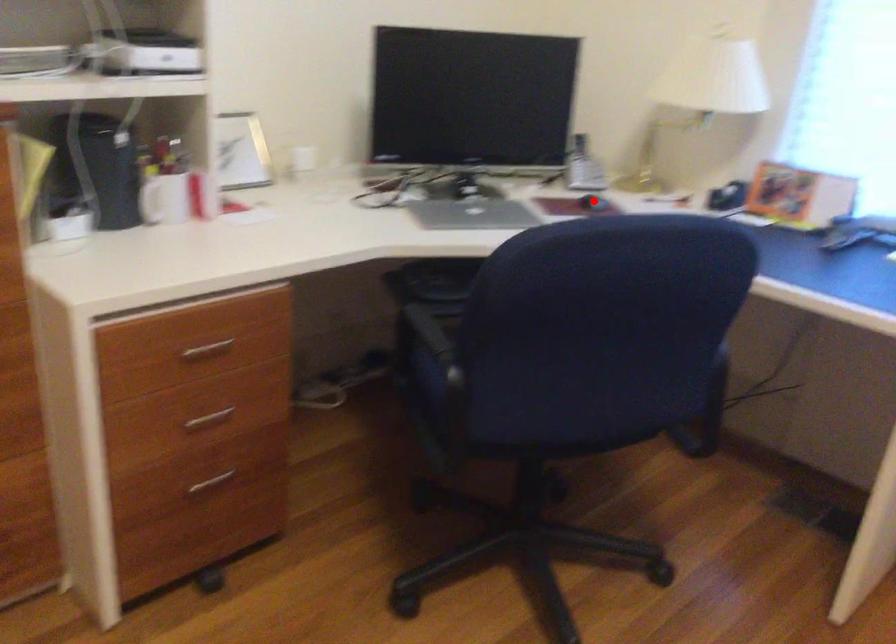
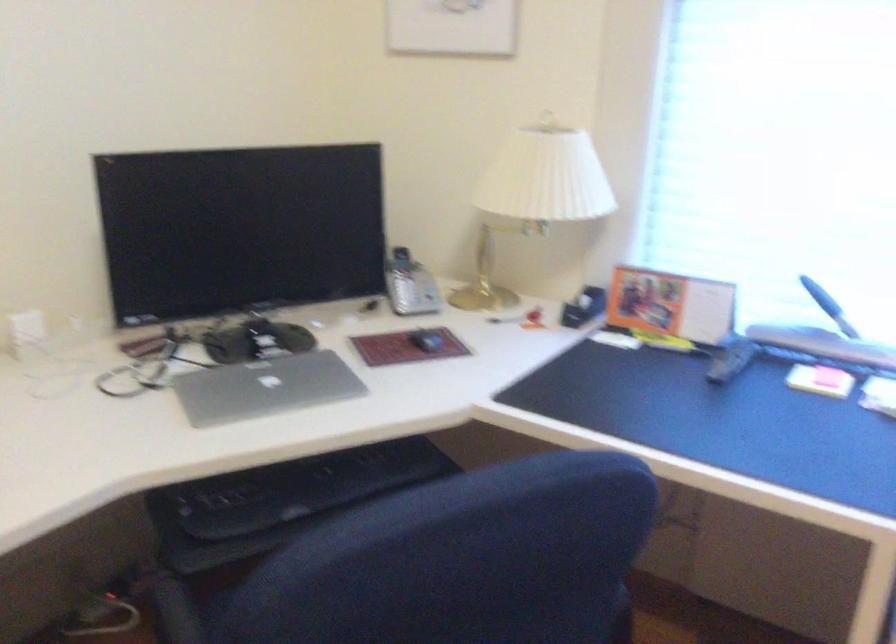
In the second image, find the point that corresponds to the highlighted location in the first image.

(426, 341)